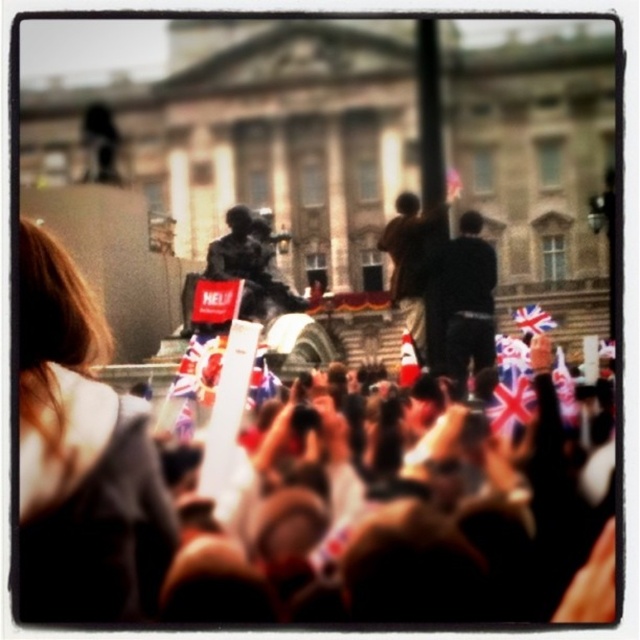
Between brown fabric at left and dark brown leather jacket at center, which one is positioned higher?

dark brown leather jacket at center

Which of these two, brown fabric at left or dark brown leather jacket at center, stands shorter?

dark brown leather jacket at center

Between point (26, 524) and point (460, 380), which one is positioned behind?

The point (460, 380) is more distant.

This screenshot has height=640, width=640. What are the coordinates of `brown fabric at left` in the screenshot? It's located at (81, 458).

Which is behind, point (268, 577) or point (61, 602)?

The point (268, 577) is more distant.

Can you confirm if brown textured fabric at center is positioned above brown fabric at left?

No.

What do you see at coordinates (401, 513) in the screenshot?
I see `brown textured fabric at center` at bounding box center [401, 513].

Identify the location of brown textured fabric at center. The width and height of the screenshot is (640, 640). (401, 513).

Can you confirm if brown textured fabric at center is thinner than dark brown leather jacket at center?

In fact, brown textured fabric at center might be wider than dark brown leather jacket at center.

Does brown textured fabric at center appear on the left side of dark brown leather jacket at center?

Correct, you'll find brown textured fabric at center to the left of dark brown leather jacket at center.

Which is in front, point (380, 470) or point (436, 288)?

Point (380, 470) is in front.

Find the location of a particular element. This screenshot has width=640, height=640. brown textured fabric at center is located at coordinates (401, 513).